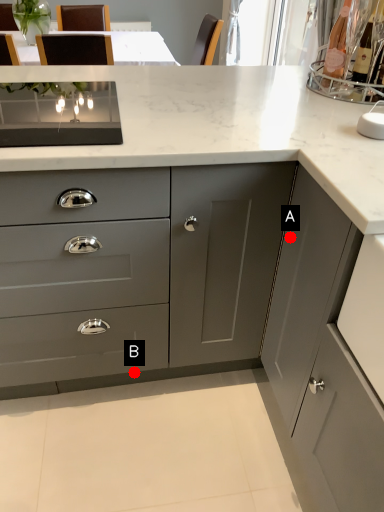
Question: Two points are circled on the image, labeled by A and B beside each circle. Which point is closer to the camera taking this photo?

Choices:
 (A) A is closer
 (B) B is closer

Answer: (A)